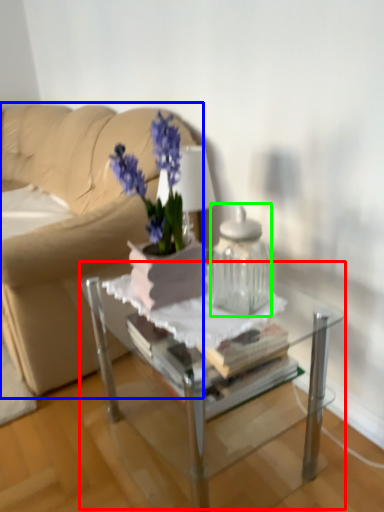
Question: Considering the real-world distances, which object is closest to table (highlighted by a red box)? studio couch (highlighted by a blue box) or vase (highlighted by a green box).

Choices:
 (A) studio couch
 (B) vase

Answer: (B)